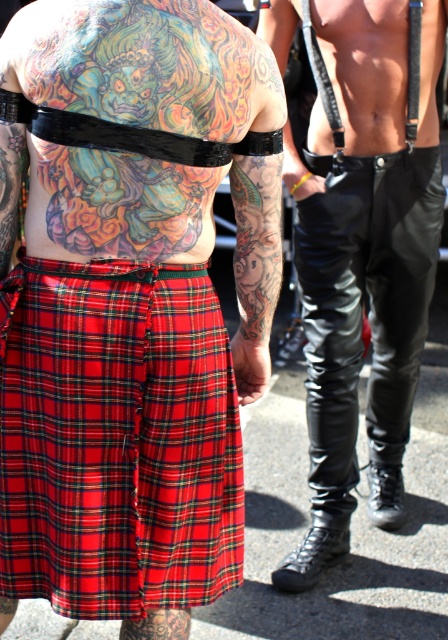
You are a photographer setting up a shoot in this scene. You need to place a spotlight to the right of the red plaid kilt at lower left and to the left of the black leather pants at center. Is this possible given their positions?

The red plaid kilt at lower left is positioned on the left side of black leather pants at center, so placing a spotlight to the right of the red plaid kilt at lower left and to the left of the black leather pants at center is possible since there is space between them.

Looking at this image, you are standing in front of the two individuals in the image. You need to reach a point that is exactly 2 meters away from you. Can you determine if the point at coordinates point [132,502] is within reach?

The point at coordinates point [132,502] is 2.07 meters away from the camera, so it is slightly out of reach if you need to reach exactly 2 meters.

You are a photographer trying to capture the red plaid kilt at center in the image. According to the coordinates provided, where exactly should you focus your camera to ensure the kilt is centered in the frame?

The red plaid kilt at center is located at coordinates point (130, 301), so you should focus your camera there to center it in the frame.